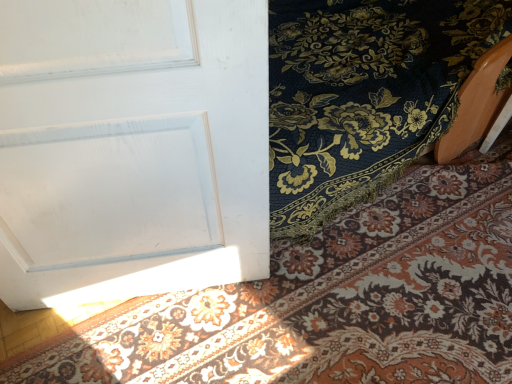
Question: Should I look upward or downward to see floral carpet at lower right?

Choices:
 (A) up
 (B) down

Answer: (B)